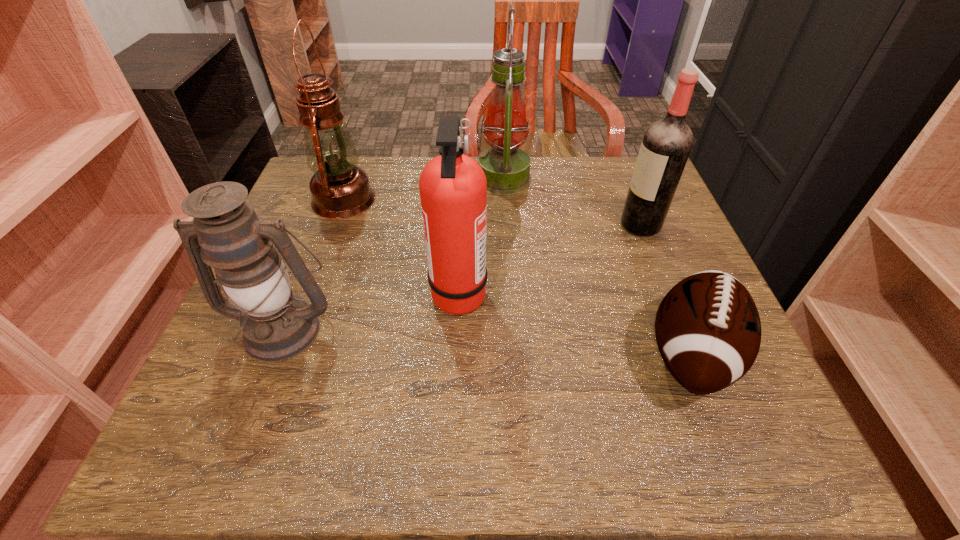
In the image, there is a desktop. Identify the location of blank space at the right edge. Image resolution: width=960 pixels, height=540 pixels. (620, 259).

Find the location of a particular element. free location at the far right corner is located at coordinates (612, 179).

Locate an element on the screen. free spot between the rightmost oil lamp and the liquor is located at coordinates (572, 201).

At what (x,y) coordinates should I click in order to perform the action: click on vacant area that lies between the fire extinguisher and the football (American). Please return your answer as a coordinate pair (x, y). Looking at the image, I should click on (575, 324).

Locate an element on the screen. This screenshot has width=960, height=540. free point between the liquor and the shortest object is located at coordinates (665, 290).

Find the location of a particular element. blank region between the liquor and the football (American) is located at coordinates (665, 290).

In order to click on free spot between the football (American) and the nearest oil lamp in this screenshot , I will do `click(488, 342)`.

Identify which object is located as the fourth nearest to the shortest oil lamp. Please provide its 2D coordinates. Your answer should be formatted as a tuple, i.e. [(x, y)], where the tuple contains the x and y coordinates of a point satisfying the conditions above.

[(708, 330)]

You are a GUI agent. You are given a task and a screenshot of the screen. Output one action in this format:
    pyautogui.click(x=<x>, y=<y>)
    Task: Click on the fifth closest object to the fire extinguisher
    This screenshot has width=960, height=540.
    Given the screenshot: What is the action you would take?
    pyautogui.click(x=666, y=145)

Identify which oil lamp is the third nearest to the fire extinguisher. Please provide its 2D coordinates. Your answer should be formatted as a tuple, i.e. [(x, y)], where the tuple contains the x and y coordinates of a point satisfying the conditions above.

[(507, 168)]